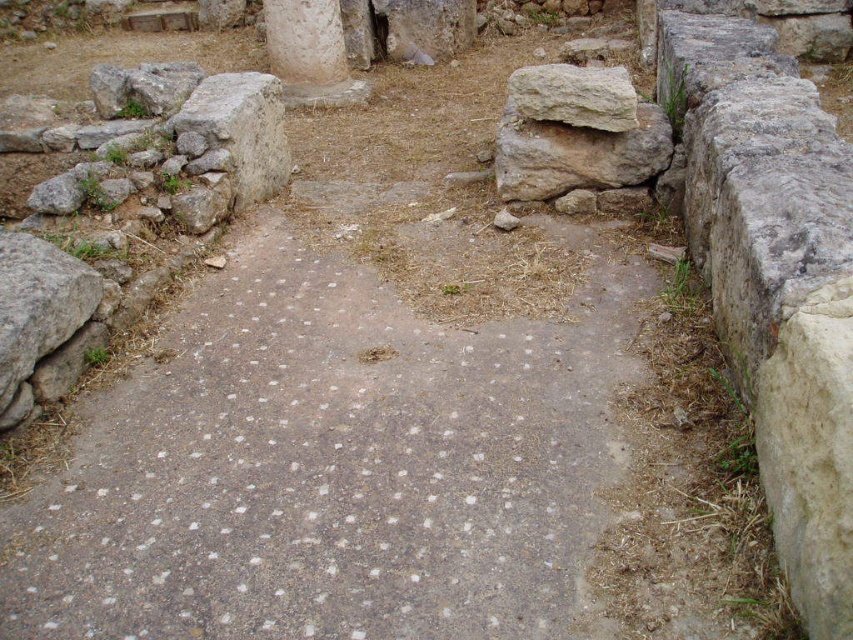
Question: Which object appears farthest from the camera in this image?

Choices:
 (A) gray stone path at center
 (B) light gray stone boulder at upper right

Answer: (B)

Question: Does gray stone path at center have a lesser width compared to light gray stone boulder at upper right?

Choices:
 (A) yes
 (B) no

Answer: (B)

Question: Is gray stone path at center in front of light gray stone boulder at upper right?

Choices:
 (A) no
 (B) yes

Answer: (B)

Question: Is gray stone path at center bigger than light gray stone boulder at upper right?

Choices:
 (A) yes
 (B) no

Answer: (A)

Question: Which of the following is the farthest from the observer?

Choices:
 (A) pos(605,120)
 (B) pos(341,440)

Answer: (A)